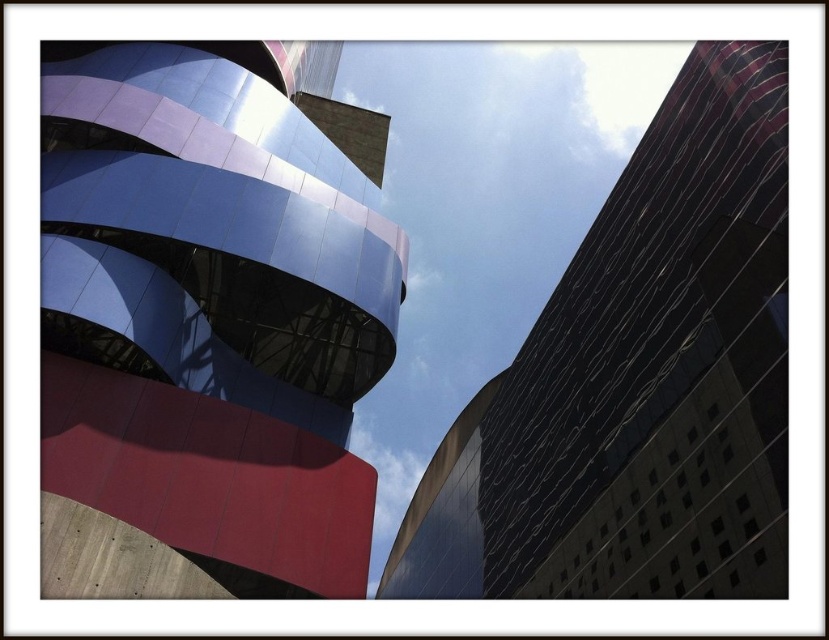
You are standing in front of the modern curved building on the left and want to take a photo of the two points marked in the scene. Which point, point (195, 292) or point (682, 198), will appear larger in your camera view?

Point (195, 292) will appear larger in the camera view because it is closer to the camera than point (682, 198).

You are an architect evaluating the two buildings in the scene. Based on their sizes, which one would require more construction materials for its exterior? Please refer to the metallic blue building at upper left and the reflective glass building at right in your consideration.

The metallic blue building at upper left requires more construction materials for its exterior since it is larger in size than the reflective glass building at right.

In the scene shown: You are an architect analyzing the layout of the two buildings in the image. The metallic blue building at upper left and the traditional rectangular building on the right. Which building is positioned closer to the top edge of the image?

The metallic blue building at upper left is located at point (204,326), which places it closer to the top edge of the image compared to the traditional rectangular building on the right.